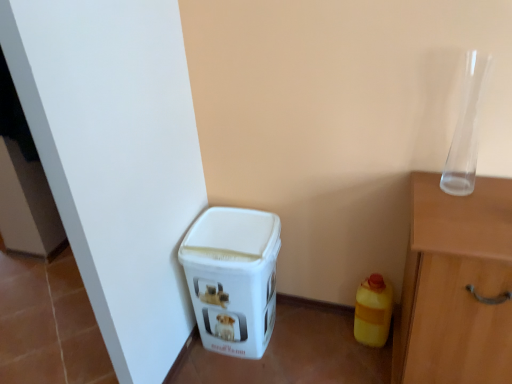
Question: Would you say transparent glass vase at upper right contains white plastic bin at lower left?

Choices:
 (A) yes
 (B) no

Answer: (B)

Question: Can you confirm if transparent glass vase at upper right is positioned to the right of white plastic bin at lower left?

Choices:
 (A) no
 (B) yes

Answer: (B)

Question: Would you say transparent glass vase at upper right is outside white plastic bin at lower left?

Choices:
 (A) yes
 (B) no

Answer: (A)

Question: Is transparent glass vase at upper right placed right next to white plastic bin at lower left?

Choices:
 (A) no
 (B) yes

Answer: (A)

Question: Is transparent glass vase at upper right oriented away from white plastic bin at lower left?

Choices:
 (A) yes
 (B) no

Answer: (B)

Question: Does transparent glass vase at upper right have a larger size compared to white plastic bin at lower left?

Choices:
 (A) yes
 (B) no

Answer: (B)

Question: From the image's perspective, is white plastic bin at lower left under transparent glass vase at upper right?

Choices:
 (A) no
 (B) yes

Answer: (B)

Question: Considering the relative sizes of white plastic bin at lower left and transparent glass vase at upper right in the image provided, is white plastic bin at lower left thinner than transparent glass vase at upper right?

Choices:
 (A) yes
 (B) no

Answer: (B)

Question: From the image's perspective, does white plastic bin at lower left appear higher than transparent glass vase at upper right?

Choices:
 (A) no
 (B) yes

Answer: (A)

Question: Could you tell me if white plastic bin at lower left is turned towards transparent glass vase at upper right?

Choices:
 (A) yes
 (B) no

Answer: (B)

Question: Would you say white plastic bin at lower left contains transparent glass vase at upper right?

Choices:
 (A) yes
 (B) no

Answer: (B)

Question: Is white plastic bin at lower left in front of transparent glass vase at upper right?

Choices:
 (A) yes
 (B) no

Answer: (B)

Question: Is yellow matte plastic bottle at lower right behind transparent glass vase at upper right?

Choices:
 (A) yes
 (B) no

Answer: (A)